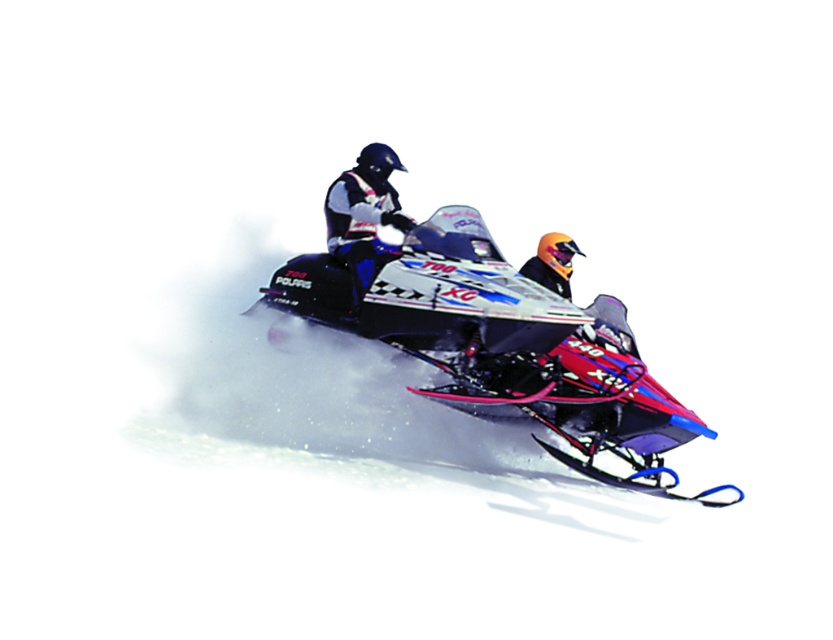
Question: Can you confirm if shiny metallic snowmobile at center is bigger than orange matte helmet at center?

Choices:
 (A) no
 (B) yes

Answer: (B)

Question: Which point is farther to the camera?

Choices:
 (A) (357, 237)
 (B) (402, 300)

Answer: (A)

Question: Is shiny metallic snowmobile at center to the left of matte black helmet at center from the viewer's perspective?

Choices:
 (A) no
 (B) yes

Answer: (A)

Question: Which point is closer to the camera?

Choices:
 (A) (408, 326)
 (B) (352, 188)
 (C) (567, 275)

Answer: (A)

Question: Is shiny metallic snowmobile at center smaller than orange matte helmet at center?

Choices:
 (A) yes
 (B) no

Answer: (B)

Question: Which object is the closest to the matte black helmet at center?

Choices:
 (A) shiny metallic snowmobile at center
 (B) orange matte helmet at center

Answer: (A)